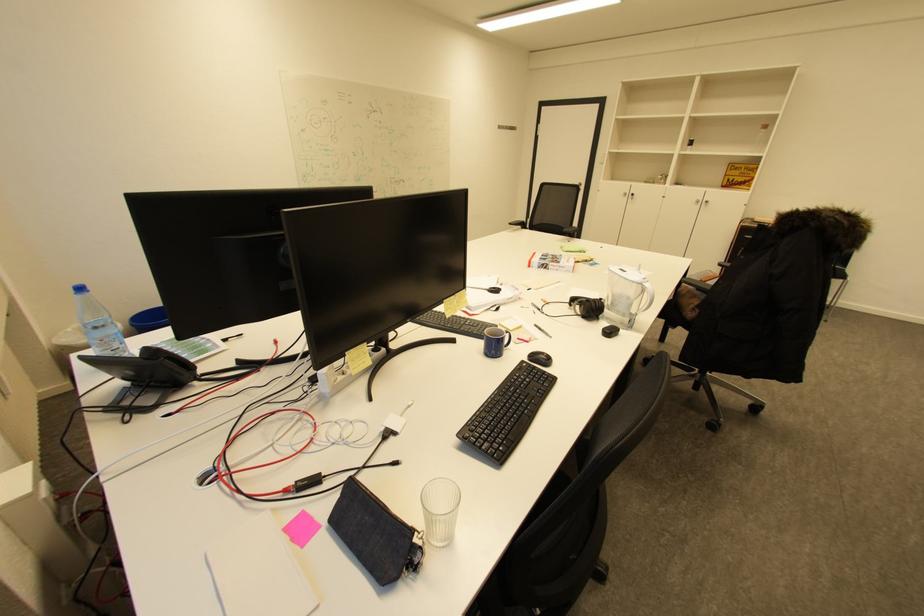
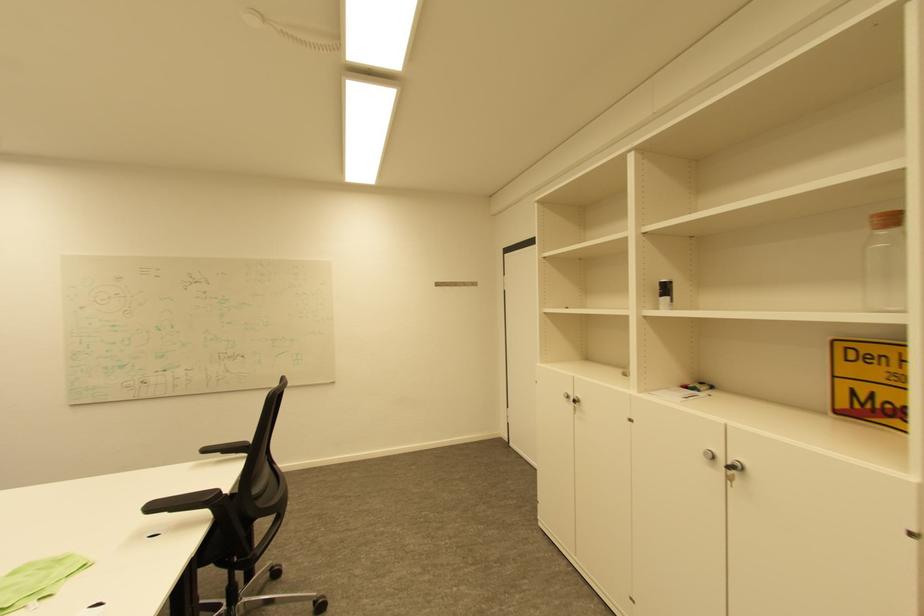
Locate, in the second image, the point that corresponds to (517,225) in the first image.

(213, 450)